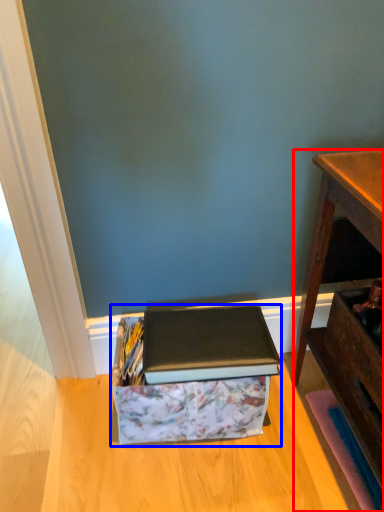
Question: Which object appears farthest to the camera in this image, desk (highlighted by a red box) or storage box (highlighted by a blue box)?

Choices:
 (A) desk
 (B) storage box

Answer: (B)